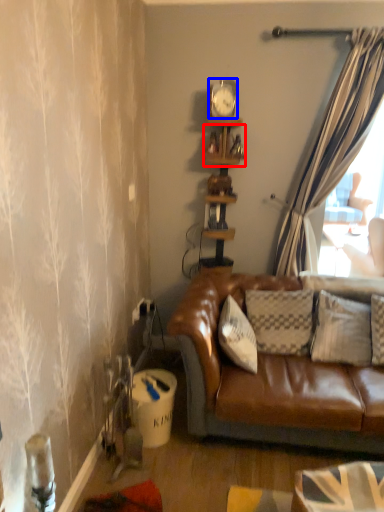
Question: Which object is further to the camera taking this photo, shelf (highlighted by a red box) or clock (highlighted by a blue box)?

Choices:
 (A) shelf
 (B) clock

Answer: (A)